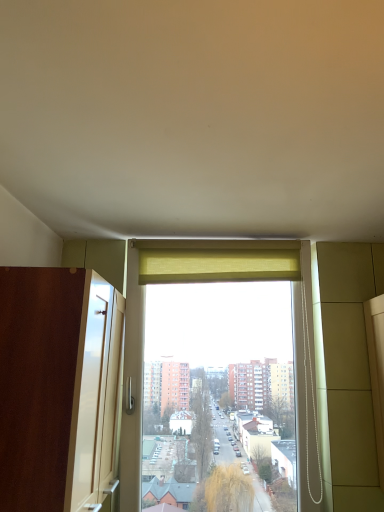
Question: Is yellow fabric curtain at upper center inside or outside of brown wood screen door at left?

Choices:
 (A) inside
 (B) outside

Answer: (B)

Question: Relative to brown wood screen door at left, is yellow fabric curtain at upper center in front or behind?

Choices:
 (A) behind
 (B) front

Answer: (A)

Question: In terms of height, does yellow fabric curtain at upper center look taller or shorter compared to brown wood screen door at left?

Choices:
 (A) tall
 (B) short

Answer: (B)

Question: In terms of height, does brown wood screen door at left look taller or shorter compared to yellow fabric curtain at upper center?

Choices:
 (A) tall
 (B) short

Answer: (A)

Question: In terms of width, does brown wood screen door at left look wider or thinner when compared to yellow fabric curtain at upper center?

Choices:
 (A) wide
 (B) thin

Answer: (A)

Question: Which is correct: brown wood screen door at left is inside yellow fabric curtain at upper center, or outside of it?

Choices:
 (A) outside
 (B) inside

Answer: (A)

Question: In the image, is brown wood screen door at left on the left side or the right side of yellow fabric curtain at upper center?

Choices:
 (A) right
 (B) left

Answer: (B)